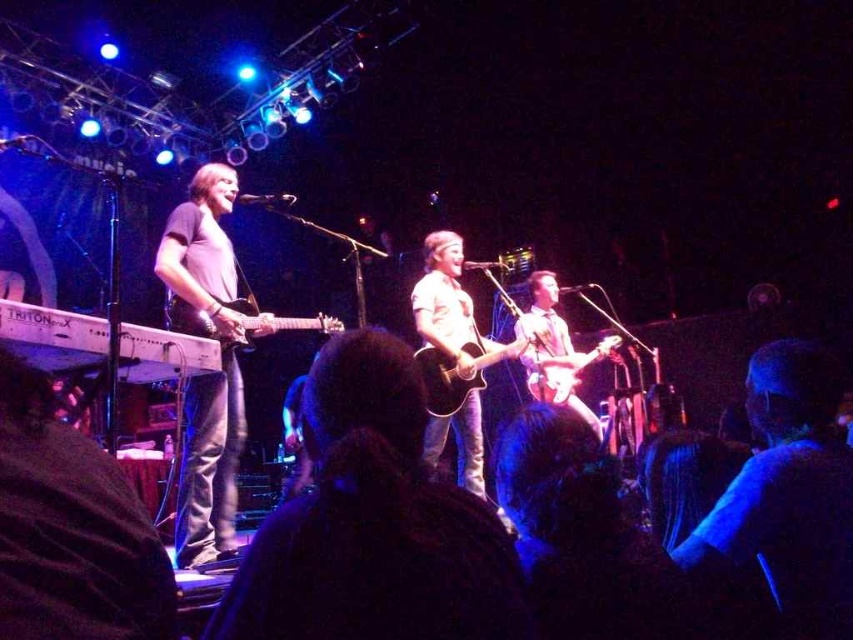
Between blue fabric shirt at center and glossy wood guitar at center, which one appears on the left side from the viewer's perspective?

Positioned to the left is blue fabric shirt at center.

From the picture: Measure the distance between point (837, 636) and camera.

Point (837, 636) and camera are 4.84 feet apart.

Locate an element on the screen. Image resolution: width=853 pixels, height=640 pixels. blue fabric shirt at center is located at coordinates (788, 493).

Describe the element at coordinates (207, 468) in the screenshot. The image size is (853, 640). I see `matte black guitar at left` at that location.

Which is in front, point (161, 240) or point (479, 426)?

Point (161, 240) is more forward.

Is point (225, 337) closer to camera compared to point (444, 230)?

Yes, it is in front of point (444, 230).

The height and width of the screenshot is (640, 853). I want to click on matte black guitar at left, so click(x=207, y=468).

Who is shorter, acoustic wood guitar at center or glossy wood guitar at center?

With less height is glossy wood guitar at center.

Based on the photo, does acoustic wood guitar at center appear under glossy wood guitar at center?

No, acoustic wood guitar at center is not below glossy wood guitar at center.

Is point (415, 358) positioned in front of point (540, 396)?

That is True.

Identify the location of acoustic wood guitar at center. (457, 372).